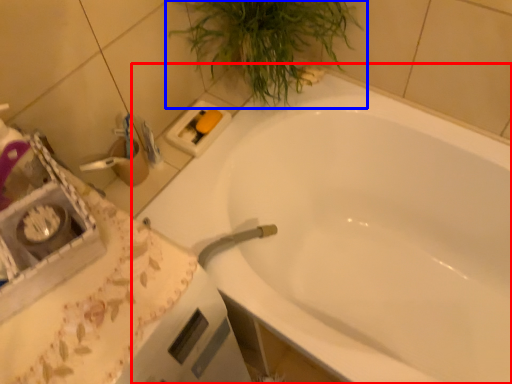
Question: Which of the following is the closest to the observer, bathtub (highlighted by a red box) or houseplant (highlighted by a blue box)?

Choices:
 (A) bathtub
 (B) houseplant

Answer: (A)